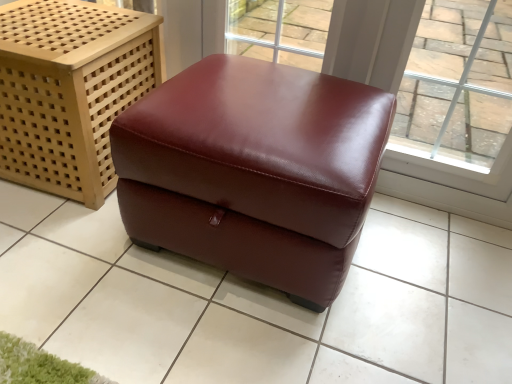
Question: Which direction should I rotate to face burgundy leather ottoman at center, the 1th furniture from the right, — up or down?

Choices:
 (A) up
 (B) down

Answer: (A)

Question: Is burgundy leather ottoman at center positioned beyond the bounds of transparent glass window at upper right?

Choices:
 (A) yes
 (B) no

Answer: (A)

Question: Is burgundy leather ottoman at center at the right side of transparent glass window at upper right?

Choices:
 (A) no
 (B) yes

Answer: (A)

Question: Can you confirm if burgundy leather ottoman at center is positioned to the left of transparent glass window at upper right?

Choices:
 (A) no
 (B) yes

Answer: (B)

Question: Is burgundy leather ottoman at center closer to camera compared to transparent glass window at upper right?

Choices:
 (A) no
 (B) yes

Answer: (B)

Question: Is burgundy leather ottoman at center shorter than transparent glass window at upper right?

Choices:
 (A) no
 (B) yes

Answer: (B)

Question: Can you see burgundy leather ottoman at center touching transparent glass window at upper right?

Choices:
 (A) no
 (B) yes

Answer: (A)

Question: From a real-world perspective, is burgundy leather ottoman at center, marked as the first furniture in a left-to-right arrangement, on transparent glass window at upper right?

Choices:
 (A) no
 (B) yes

Answer: (A)

Question: From a real-world perspective, is burgundy leather ottoman at center, positioned as the second furniture in right-to-left order, under transparent glass window at upper right?

Choices:
 (A) yes
 (B) no

Answer: (A)

Question: From the image's perspective, would you say burgundy leather ottoman at center, marked as the first furniture in a left-to-right arrangement, is shown under transparent glass window at upper right?

Choices:
 (A) yes
 (B) no

Answer: (B)

Question: Is burgundy leather ottoman at center, marked as the first furniture in a left-to-right arrangement, to the right of transparent glass window at upper right from the viewer's perspective?

Choices:
 (A) no
 (B) yes

Answer: (A)

Question: Does burgundy leather ottoman at center, marked as the first furniture in a left-to-right arrangement, have a larger size compared to transparent glass window at upper right?

Choices:
 (A) no
 (B) yes

Answer: (B)

Question: Is burgundy leather ottoman at center, marked as the first furniture in a left-to-right arrangement, looking in the opposite direction of transparent glass window at upper right?

Choices:
 (A) no
 (B) yes

Answer: (A)

Question: Does burgundy leather ottoman at center, the 1th furniture from the right, have a greater height compared to burgundy leather ottoman at center?

Choices:
 (A) no
 (B) yes

Answer: (B)